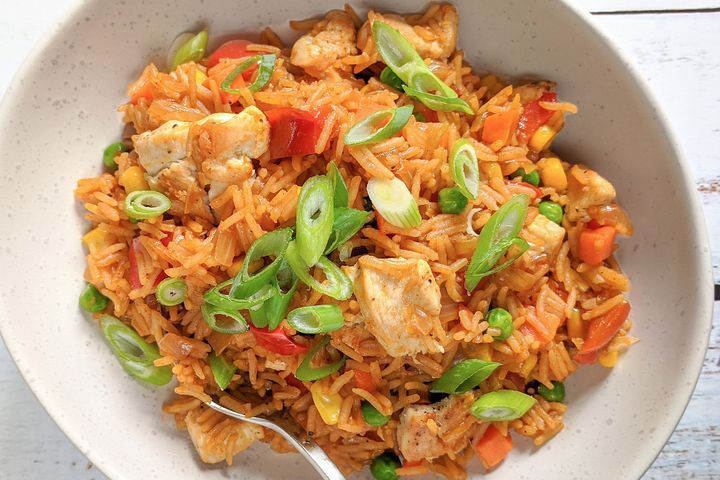
I want to click on table, so click(x=685, y=463).